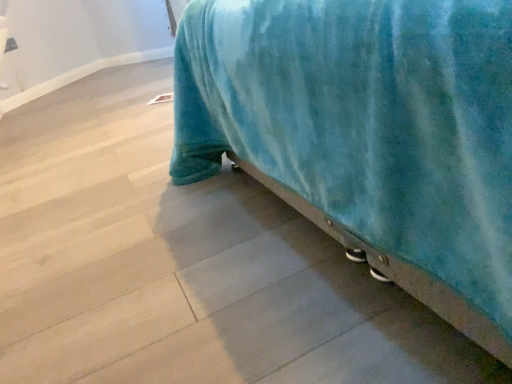
What do you see at coordinates (368, 133) in the screenshot?
I see `velvet blue bed at lower right` at bounding box center [368, 133].

Identify the location of velvet blue bed at lower right. The image size is (512, 384). (368, 133).

Where is `velvet blue bed at lower right`? This screenshot has height=384, width=512. velvet blue bed at lower right is located at coordinates (368, 133).